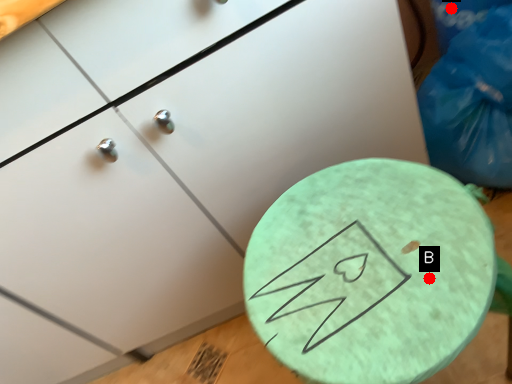
Question: Two points are circled on the image, labeled by A and B beside each circle. Which point appears farthest from the camera in this image?

Choices:
 (A) A is further
 (B) B is further

Answer: (A)